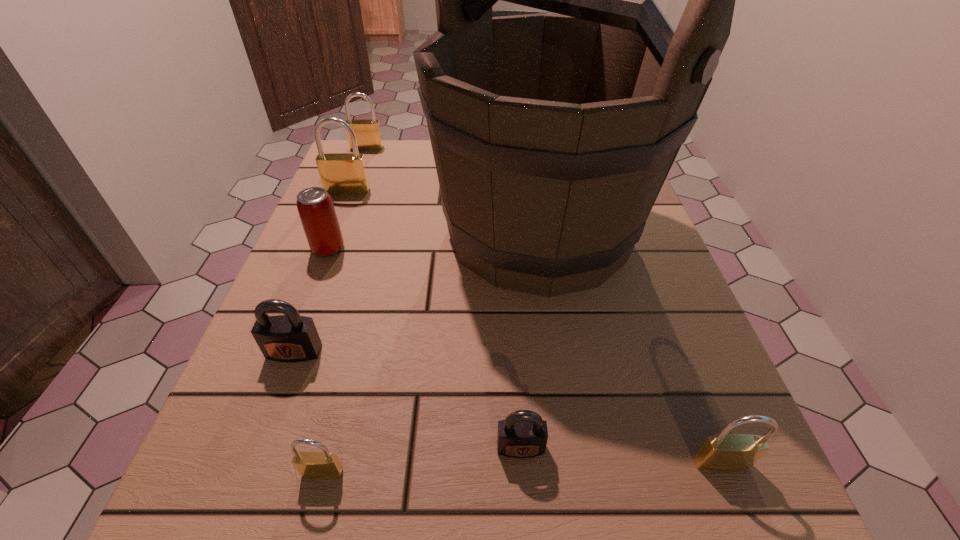
The image size is (960, 540). Identify the location of vacant space at the left edge of the desktop. (287, 287).

The height and width of the screenshot is (540, 960). What are the coordinates of `free space at the right edge of the desktop` in the screenshot? It's located at (652, 298).

At what (x,y) coordinates should I click in order to perform the action: click on free space at the far left corner of the desktop. Please return your answer as a coordinate pair (x, y). Image resolution: width=960 pixels, height=540 pixels. Looking at the image, I should click on (373, 154).

The height and width of the screenshot is (540, 960). I want to click on empty space between the smaller gray padlock and the rightmost brass padlock, so click(x=621, y=455).

At what (x,y) coordinates should I click in order to perform the action: click on blank region between the seventh shortest object and the farther gray padlock. Please return your answer as a coordinate pair (x, y). The height and width of the screenshot is (540, 960). Looking at the image, I should click on (321, 271).

Identify the location of vacant area that lies between the rightmost padlock and the right gray padlock. The height and width of the screenshot is (540, 960). (621, 455).

Identify the location of free area in between the pink beer can and the third brass padlock from left to right. (325, 361).

Where is `empty location between the third brass padlock from left to right and the fifth nearest padlock`? The height and width of the screenshot is (540, 960). empty location between the third brass padlock from left to right and the fifth nearest padlock is located at coordinates (335, 332).

The image size is (960, 540). I want to click on blank region between the bucket and the fifth farthest object, so click(x=417, y=292).

At what (x,y) coordinates should I click in order to perform the action: click on vacant area that lies between the smaller gray padlock and the rightmost brass padlock. Please return your answer as a coordinate pair (x, y). The image size is (960, 540). Looking at the image, I should click on (621, 455).